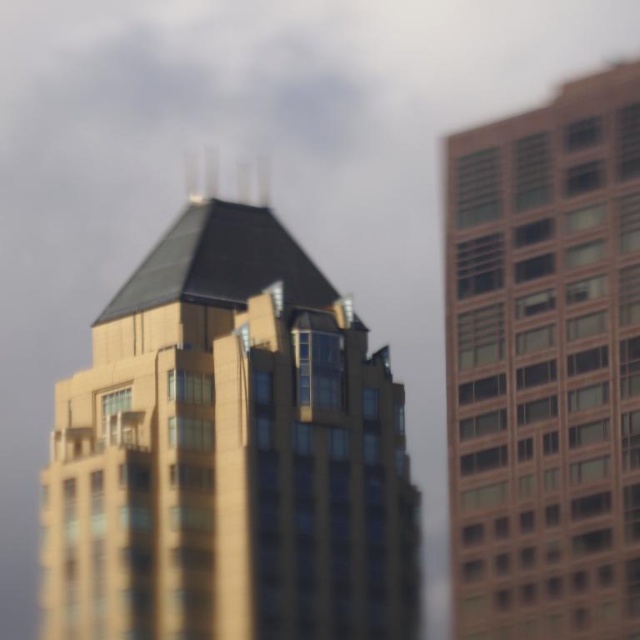
From the picture: Is gold glass building at center thinner than brown brick building at right?

In fact, gold glass building at center might be wider than brown brick building at right.

Which is below, gold glass building at center or brown brick building at right?

gold glass building at center

Does point (138, 557) lie in front of point (556, 188)?

Yes, point (138, 557) is in front of point (556, 188).

Identify the location of gold glass building at center. The width and height of the screenshot is (640, 640). (228, 451).